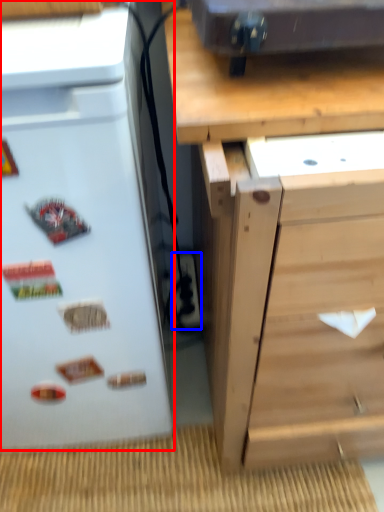
Question: Among these objects, which one is farthest to the camera, refrigerator (highlighted by a red box) or electric outlet (highlighted by a blue box)?

Choices:
 (A) refrigerator
 (B) electric outlet

Answer: (B)